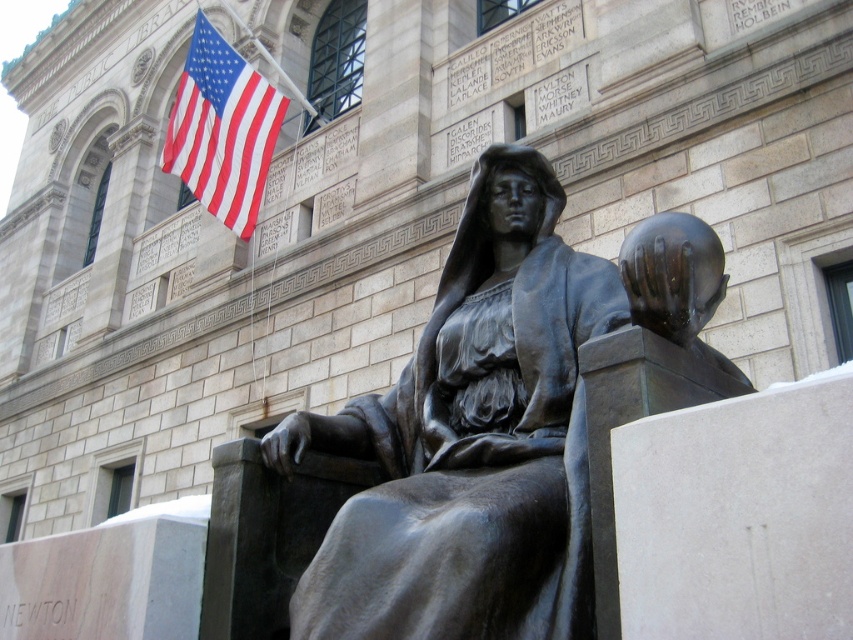
Does bronze statue at center have a lesser height compared to red-white striped fabric at upper left?

Yes, bronze statue at center is shorter than red-white striped fabric at upper left.

Describe the element at coordinates (471, 440) in the screenshot. Image resolution: width=853 pixels, height=640 pixels. I see `bronze statue at center` at that location.

You are a GUI agent. You are given a task and a screenshot of the screen. Output one action in this format:
    pyautogui.click(x=<x>, y=<y>)
    Task: Click on the bronze statue at center
    The width and height of the screenshot is (853, 640).
    Given the screenshot: What is the action you would take?
    pyautogui.click(x=471, y=440)

Locate an element on the screen. This screenshot has width=853, height=640. bronze statue at center is located at coordinates (471, 440).